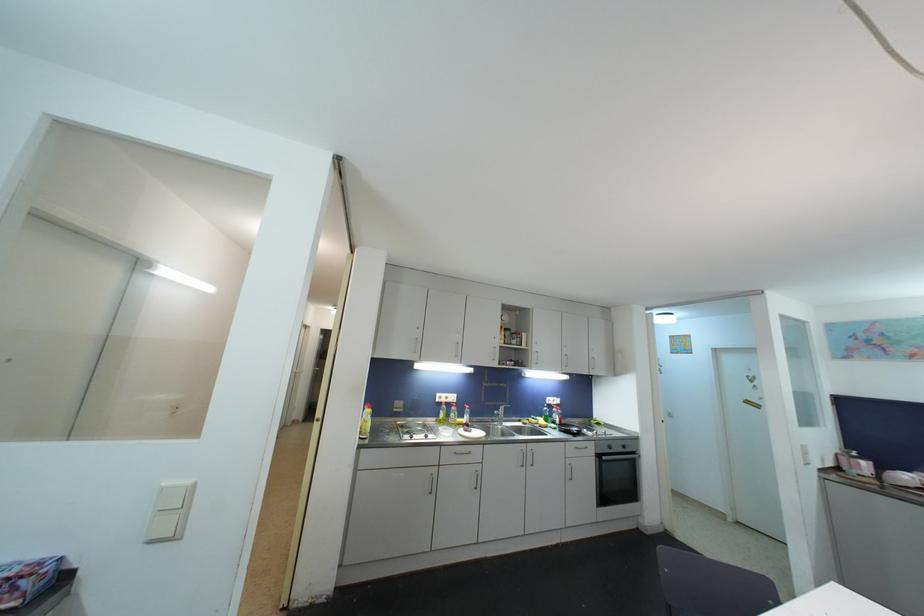
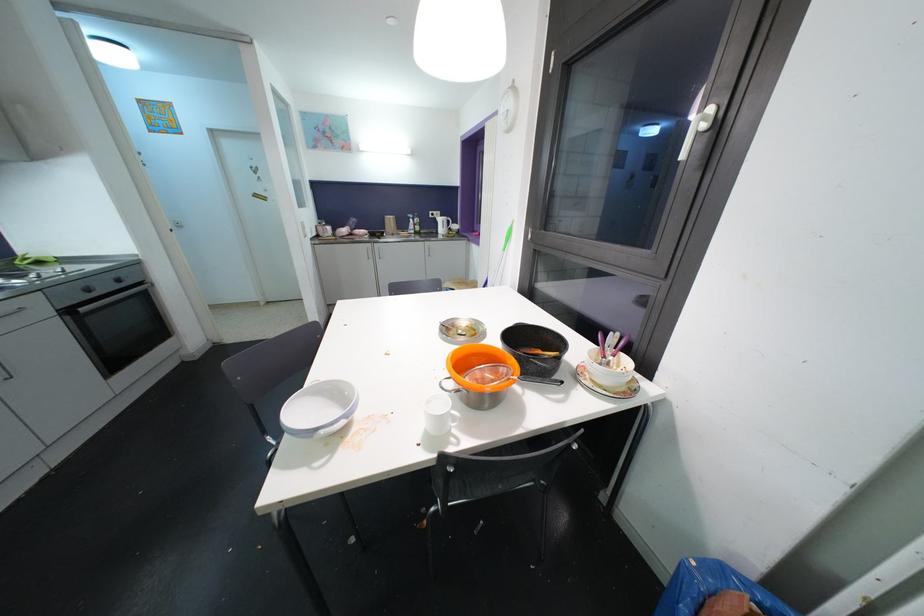
Locate, in the second image, the point that corresponds to point 611,446 in the first image.

(83, 286)